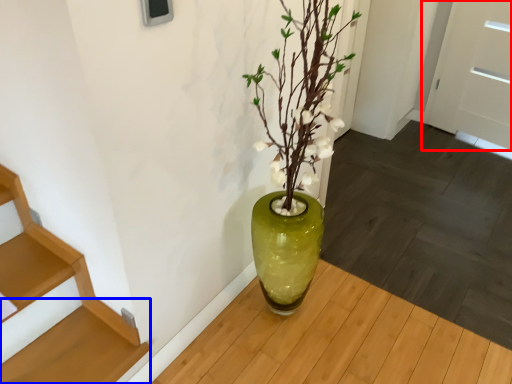
Question: Which point is closer to the camera, door (highlighted by a red box) or stairs (highlighted by a blue box)?

Choices:
 (A) door
 (B) stairs

Answer: (B)